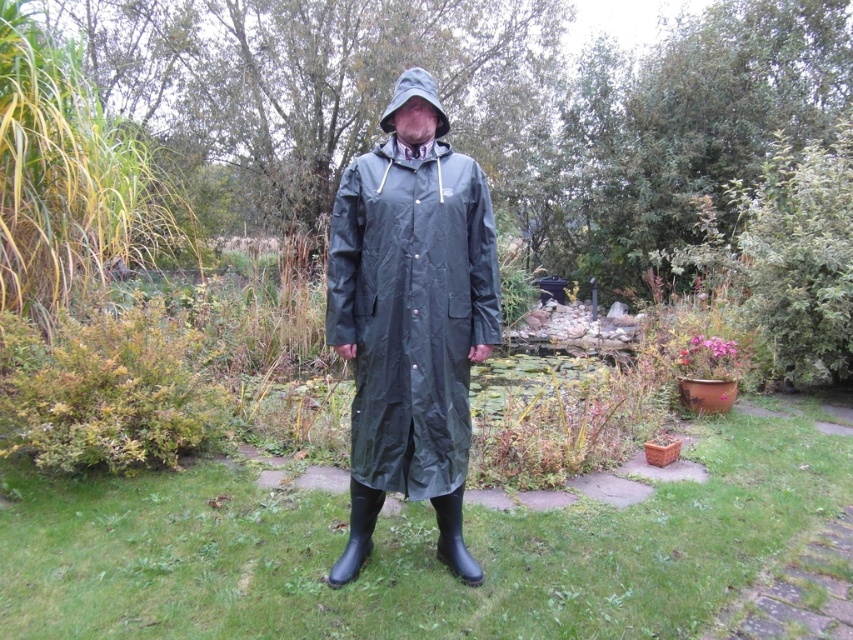
You are planning to take a photo of the person in the garden. The matte black raincoat at center and the matte gray hood at center are both important elements. Which object is located below the other in the image?

The matte black raincoat at center is positioned under the matte gray hood at center, so the raincoat is below the hood.